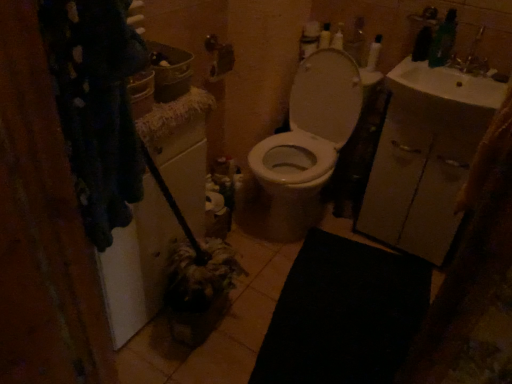
This screenshot has height=384, width=512. What do you see at coordinates (305, 146) in the screenshot?
I see `white glossy toilet at center` at bounding box center [305, 146].

The width and height of the screenshot is (512, 384). Find the location of `white glossy toilet at center`. white glossy toilet at center is located at coordinates (305, 146).

Is point (377, 53) more distant than point (464, 100)?

Yes, point (377, 53) is farther from viewer.

Does white glossy bottle at upper right have a lesser height compared to white glossy sink at upper right?

No, white glossy bottle at upper right is not shorter than white glossy sink at upper right.

Are white glossy bottle at upper right and white glossy sink at upper right far apart?

white glossy bottle at upper right is near white glossy sink at upper right, not far away.

Based on the photo, from the image's perspective, is white glossy bottle at upper right on top of white glossy sink at upper right?

Correct, white glossy bottle at upper right appears higher than white glossy sink at upper right in the image.

In the image, is white glossy sink at upper right positioned in front of or behind white glossy toilet at center?

Clearly, white glossy sink at upper right is in front of white glossy toilet at center.

Is white glossy sink at upper right with white glossy toilet at center?

No, white glossy sink at upper right is not next to white glossy toilet at center.

Who is taller, white glossy sink at upper right or white glossy toilet at center?

white glossy toilet at center.

Which is more to the right, white glossy sink at upper right or white glossy toilet at center?

white glossy sink at upper right is more to the right.

Considering the relative positions of white glossy sink at upper right and white glossy bottle at upper right in the image provided, is white glossy sink at upper right to the left or to the right of white glossy bottle at upper right?

white glossy sink at upper right is to the right of white glossy bottle at upper right.

Looking at their sizes, would you say white glossy sink at upper right is wider or thinner than white glossy bottle at upper right?

white glossy sink at upper right is wider than white glossy bottle at upper right.

From the image's perspective, is white glossy sink at upper right above or below white glossy bottle at upper right?

From the image's perspective, white glossy sink at upper right appears below white glossy bottle at upper right.

Based on the photo, could you tell me if white glossy bottle at upper right is turned towards white glossy toilet at center?

Yes, white glossy bottle at upper right faces towards white glossy toilet at center.

Find the location of a particular element. toilet in front of the white glossy bottle at upper right is located at coordinates (305, 146).

From the image's perspective, is white glossy bottle at upper right under white glossy toilet at center?

Actually, white glossy bottle at upper right appears above white glossy toilet at center in the image.

In terms of height, does white glossy bottle at upper right look taller or shorter compared to white glossy toilet at center?

In the image, white glossy bottle at upper right appears to be shorter than white glossy toilet at center.

How different are the orientations of white glossy toilet at center and white glossy bottle at upper right in degrees?

white glossy toilet at center and white glossy bottle at upper right are facing 3.29 degrees away from each other.

Which object is more forward, white glossy toilet at center or white glossy bottle at upper right?

white glossy toilet at center is in front.

Considering the sizes of white glossy toilet at center and white glossy bottle at upper right in the image, is white glossy toilet at center bigger or smaller than white glossy bottle at upper right?

Considering their sizes, white glossy toilet at center takes up more space than white glossy bottle at upper right.

Looking at their sizes, would you say white glossy toilet at center is wider or thinner than white glossy sink at upper right?

In the image, white glossy toilet at center appears to be wider than white glossy sink at upper right.

Which is more to the left, white glossy toilet at center or white glossy sink at upper right?

From the viewer's perspective, white glossy toilet at center appears more on the left side.

Does point (323, 156) come in front of point (419, 83)?

No, it is not.

Where is `toiletry above the white glossy sink at upper right (from a real-world perspective)`? This screenshot has height=384, width=512. toiletry above the white glossy sink at upper right (from a real-world perspective) is located at coordinates (374, 53).

The width and height of the screenshot is (512, 384). Identify the location of sink in front of the white glossy toilet at center. (449, 83).

Considering their positions, is white glossy bottle at upper right positioned further to white glossy sink at upper right than white glossy toilet at center?

white glossy toilet at center is further to white glossy sink at upper right.

Estimate the real-world distances between objects in this image. Which object is further from white glossy bottle at upper right, white glossy toilet at center or white glossy sink at upper right?

white glossy toilet at center.

Looking at the image, which one is located further to white glossy bottle at upper right, white glossy sink at upper right or white glossy toilet at center?

The object further to white glossy bottle at upper right is white glossy toilet at center.

Looking at the image, which one is located further to white glossy toilet at center, white glossy bottle at upper right or white glossy sink at upper right?

white glossy bottle at upper right lies further to white glossy toilet at center than the other object.

Considering their positions, is white glossy toilet at center positioned closer to white glossy sink at upper right than white glossy bottle at upper right?

white glossy bottle at upper right.

Considering their positions, is white glossy sink at upper right positioned further to white glossy toilet at center than white glossy bottle at upper right?

The object further to white glossy toilet at center is white glossy bottle at upper right.

This screenshot has height=384, width=512. Find the location of `toiletry located between white glossy toilet at center and white glossy sink at upper right in the left-right direction`. toiletry located between white glossy toilet at center and white glossy sink at upper right in the left-right direction is located at coordinates (374, 53).